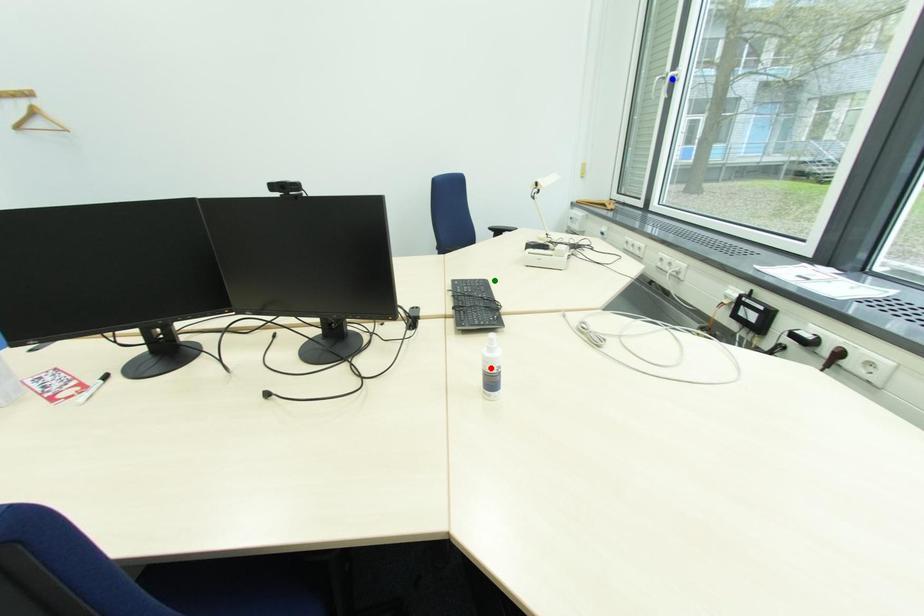
Based on the photo, order these from nearest to farthest:
green point | red point | blue point

red point, green point, blue point